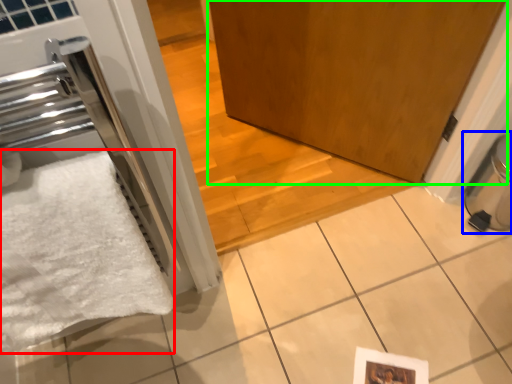
Question: Based on their relative distances, which object is farther from bath towel (highlighted by a red box)? Choose from water heater (highlighted by a blue box) and door (highlighted by a green box).

Choices:
 (A) water heater
 (B) door

Answer: (A)